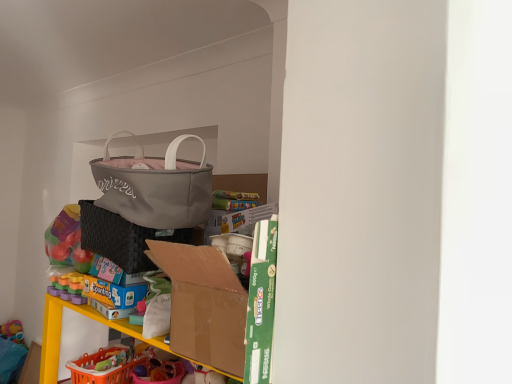
Question: Could you tell me if cardboard box at center is turned towards black woven laundry basket at center?

Choices:
 (A) yes
 (B) no

Answer: (B)

Question: From the image's perspective, does cardboard box at center appear lower than black woven laundry basket at center?

Choices:
 (A) no
 (B) yes

Answer: (B)

Question: Does cardboard box at center contain black woven laundry basket at center?

Choices:
 (A) yes
 (B) no

Answer: (B)

Question: Is cardboard box at center oriented away from black woven laundry basket at center?

Choices:
 (A) no
 (B) yes

Answer: (A)

Question: Is cardboard box at center thinner than black woven laundry basket at center?

Choices:
 (A) no
 (B) yes

Answer: (B)

Question: From a real-world perspective, is cardboard box at center located beneath black woven laundry basket at center?

Choices:
 (A) yes
 (B) no

Answer: (A)

Question: Can you confirm if black woven laundry basket at center is bigger than cardboard box at center?

Choices:
 (A) yes
 (B) no

Answer: (B)

Question: Is black woven laundry basket at center to the left of cardboard box at center from the viewer's perspective?

Choices:
 (A) yes
 (B) no

Answer: (A)

Question: Does black woven laundry basket at center have a lesser width compared to cardboard box at center?

Choices:
 (A) yes
 (B) no

Answer: (B)

Question: Is black woven laundry basket at center closer to camera compared to cardboard box at center?

Choices:
 (A) no
 (B) yes

Answer: (A)

Question: Is black woven laundry basket at center to the right of cardboard box at center from the viewer's perspective?

Choices:
 (A) yes
 (B) no

Answer: (B)

Question: Is cardboard box at center at the back of black woven laundry basket at center?

Choices:
 (A) no
 (B) yes

Answer: (A)

Question: Does matte gray handbag at upper center have a larger size compared to black woven laundry basket at center?

Choices:
 (A) yes
 (B) no

Answer: (A)